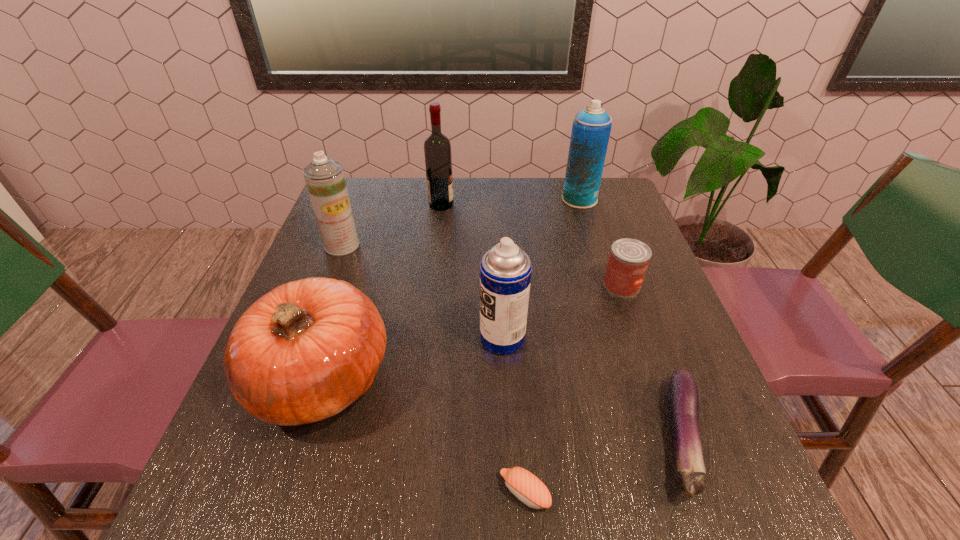
Identify the location of vacant area that satisfies the following two spatial constraints: 1. on the front side of the rightmost aerosol can; 2. on the right side of the sixth tallest object. 606,285.

Where is `free location that satisfies the following two spatial constraints: 1. on the back side of the shortest object; 2. on the right side of the fifth nearest object`? The width and height of the screenshot is (960, 540). free location that satisfies the following two spatial constraints: 1. on the back side of the shortest object; 2. on the right side of the fifth nearest object is located at coordinates (510, 285).

Find the location of a particular element. The height and width of the screenshot is (540, 960). blank space that satisfies the following two spatial constraints: 1. on the label side of the seventh tallest object; 2. on the left side of the nearest aerosol can is located at coordinates (507, 438).